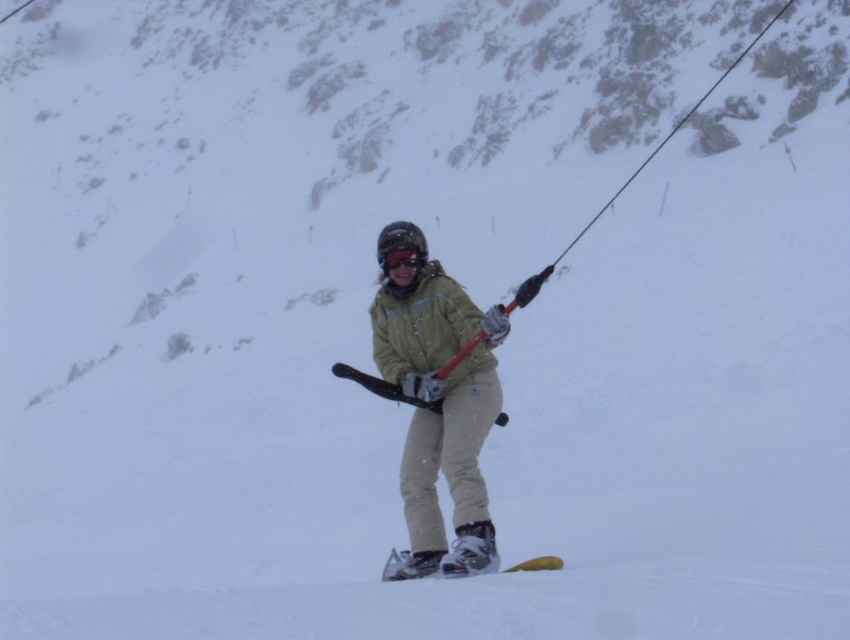
Question: Among these points, which one is farthest from the camera?

Choices:
 (A) (366, 378)
 (B) (408, 244)
 (C) (533, 561)
 (D) (480, 572)

Answer: (B)

Question: Considering the real-world distances, which object is closest to the matte yellow jacket at center?

Choices:
 (A) matte black ski at center
 (B) white plastic ski at lower center
 (C) matte black goggles at center

Answer: (C)

Question: Can you confirm if matte yellow jacket at center is positioned to the right of matte black goggles at center?

Choices:
 (A) yes
 (B) no

Answer: (B)

Question: Which point is closer to the camera?

Choices:
 (A) matte yellow jacket at center
 (B) matte black ski at center

Answer: (B)

Question: Does matte black ski at center appear on the left side of white plastic ski at lower center?

Choices:
 (A) no
 (B) yes

Answer: (B)

Question: Is matte yellow jacket at center smaller than matte black ski at center?

Choices:
 (A) no
 (B) yes

Answer: (B)